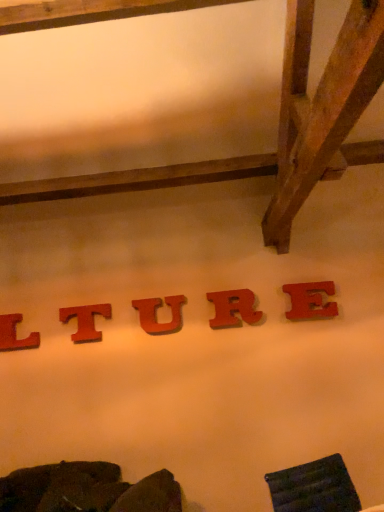
Question: Is red wood letter at lower left, arranged as the 5th letter when viewed from the right, outside of matte wood letter u at center, which is the 3th letter in left-to-right order?

Choices:
 (A) yes
 (B) no

Answer: (A)

Question: Is red wood letter at lower left, the first letter in the left-to-right sequence, bigger than matte wood letter u at center, which is the 3th letter in left-to-right order?

Choices:
 (A) no
 (B) yes

Answer: (A)

Question: Is red wood letter at lower left, the first letter in the left-to-right sequence, further to camera compared to matte wood letter u at center, the 3th letter from the right?

Choices:
 (A) yes
 (B) no

Answer: (A)

Question: Is red wood letter at lower left, the first letter in the left-to-right sequence, at the right side of matte wood letter u at center, which is the 3th letter in left-to-right order?

Choices:
 (A) no
 (B) yes

Answer: (A)

Question: Is red wood letter at lower left, arranged as the 5th letter when viewed from the right, taller than matte wood letter u at center, which is the 3th letter in left-to-right order?

Choices:
 (A) yes
 (B) no

Answer: (B)

Question: Looking at the image, does matte wood letter u at center, the 3th letter from the right, seem bigger or smaller compared to matte wood letter r at center, arranged as the 4th letter when viewed from the left?

Choices:
 (A) big
 (B) small

Answer: (B)

Question: From the image's perspective, is matte wood letter u at center, which is the 3th letter in left-to-right order, located above or below matte wood letter r at center, which appears as the 2th letter when viewed from the right?

Choices:
 (A) above
 (B) below

Answer: (B)

Question: In the image, is matte wood letter u at center, which is the 3th letter in left-to-right order, on the left side or the right side of matte wood letter r at center, arranged as the 4th letter when viewed from the left?

Choices:
 (A) right
 (B) left

Answer: (B)

Question: Considering the positions of matte wood letter u at center, which is the 3th letter in left-to-right order, and matte wood letter r at center, which appears as the 2th letter when viewed from the right, in the image, is matte wood letter u at center, which is the 3th letter in left-to-right order, wider or thinner than matte wood letter r at center, which appears as the 2th letter when viewed from the right,?

Choices:
 (A) wide
 (B) thin

Answer: (B)

Question: From the image's perspective, relative to matte wood letter t at center, the second letter in the left-to-right sequence, is matte wood letter u at center, the 3th letter from the right, above or below?

Choices:
 (A) above
 (B) below

Answer: (A)

Question: Is matte wood letter u at center, which is the 3th letter in left-to-right order, wider or thinner than matte wood letter t at center, the second letter in the left-to-right sequence?

Choices:
 (A) wide
 (B) thin

Answer: (B)

Question: Is matte wood letter u at center, which is the 3th letter in left-to-right order, in front of or behind matte wood letter t at center, which is counted as the 4th letter, starting from the right, in the image?

Choices:
 (A) behind
 (B) front

Answer: (B)

Question: Is matte wood letter u at center, the 3th letter from the right, spatially inside matte wood letter t at center, the second letter in the left-to-right sequence, or outside of it?

Choices:
 (A) outside
 (B) inside

Answer: (A)

Question: From a real-world perspective, is matte wood letter r at center, which appears as the 2th letter when viewed from the right, above or below velvet dark green swivel chair at lower right?

Choices:
 (A) below
 (B) above

Answer: (B)

Question: Based on their sizes in the image, would you say matte wood letter r at center, arranged as the 4th letter when viewed from the left, is bigger or smaller than velvet dark green swivel chair at lower right?

Choices:
 (A) small
 (B) big

Answer: (A)